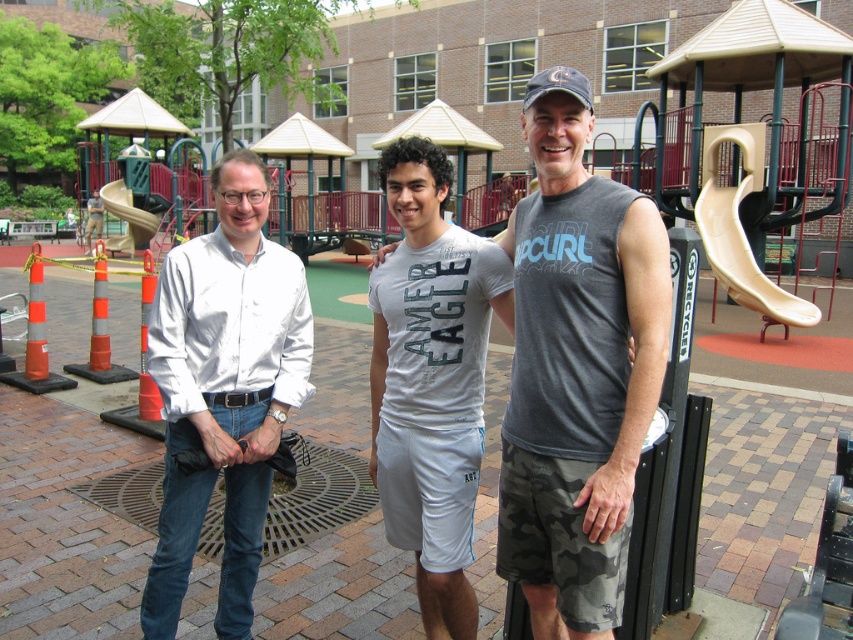
Between gray sleeveless shirt at center and white glossy shirt at center, which one has less height?

Standing shorter between the two is white glossy shirt at center.

Locate an element on the screen. This screenshot has height=640, width=853. gray sleeveless shirt at center is located at coordinates (577, 369).

Identify the location of gray sleeveless shirt at center. (577, 369).

Which is in front, point (637, 326) or point (488, 321)?

Positioned in front is point (637, 326).

Can you confirm if gray sleeveless shirt at center is wider than white cotton t-shirt at center?

In fact, gray sleeveless shirt at center might be narrower than white cotton t-shirt at center.

Identify the location of gray sleeveless shirt at center. Image resolution: width=853 pixels, height=640 pixels. (577, 369).

Locate an element on the screen. gray sleeveless shirt at center is located at coordinates (577, 369).

Between white glossy shirt at center and white cotton t-shirt at center, which one appears on the right side from the viewer's perspective?

From the viewer's perspective, white cotton t-shirt at center appears more on the right side.

Does white glossy shirt at center come in front of white cotton t-shirt at center?

No.

This screenshot has width=853, height=640. Identify the location of white glossy shirt at center. coord(224,390).

What are the coordinates of `white glossy shirt at center` in the screenshot? It's located at (224, 390).